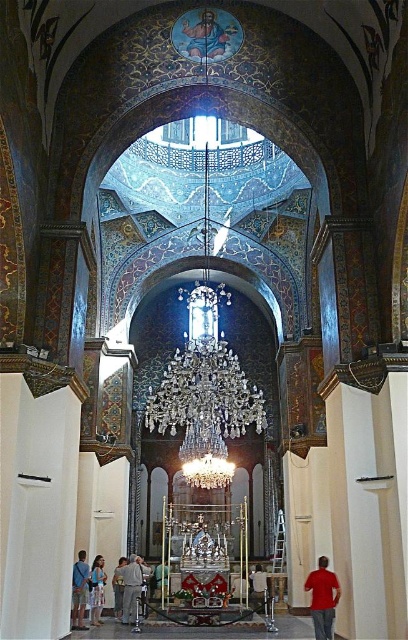
You are standing in the grand cathedral and notice two items at the lower left corner of the image. Which one is positioned more to the left between the blue denim jeans at lower left and the white floral dress at lower left?

The blue denim jeans at lower left is positioned on the left side of white floral dress at lower left, so the blue denim jeans at lower left is more to the left.

You are standing in the church and want to move from the blue denim jeans at lower left to the gray fabric pants at lower center. Which direction should you move to reach them?

The gray fabric pants at lower center is to the right of the blue denim jeans at lower left, so you should move to the right to reach them.